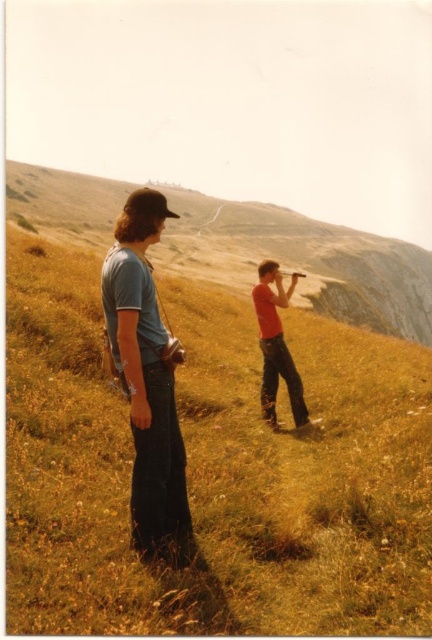
Question: Can you confirm if yellow grass at center is thinner than matte red shirt at center?

Choices:
 (A) no
 (B) yes

Answer: (A)

Question: Which of these objects is positioned farthest from the yellow grassy at center?

Choices:
 (A) yellow grass at center
 (B) matte red shirt at center
 (C) denim jeans at center

Answer: (A)

Question: Does denim jeans at center have a lesser width compared to matte red shirt at center?

Choices:
 (A) yes
 (B) no

Answer: (B)

Question: Considering the relative positions of denim jeans at center and matte red shirt at center in the image provided, where is denim jeans at center located with respect to matte red shirt at center?

Choices:
 (A) above
 (B) below

Answer: (B)

Question: Which object is closer to the camera taking this photo?

Choices:
 (A) denim jeans at center
 (B) matte red shirt at center
 (C) yellow grassy at center

Answer: (C)

Question: Which object is the closest to the yellow grassy at center?

Choices:
 (A) denim jeans at center
 (B) matte red shirt at center

Answer: (B)